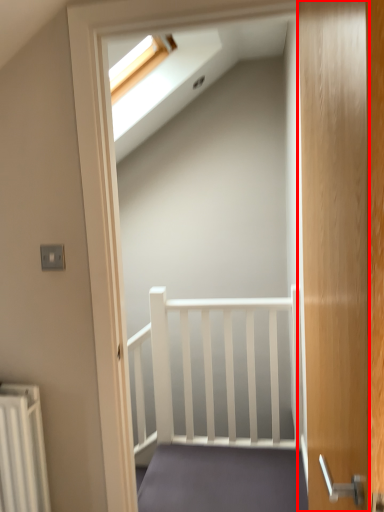
Question: Where is door (annotated by the red box) located in relation to stairs in the image?

Choices:
 (A) right
 (B) left

Answer: (A)